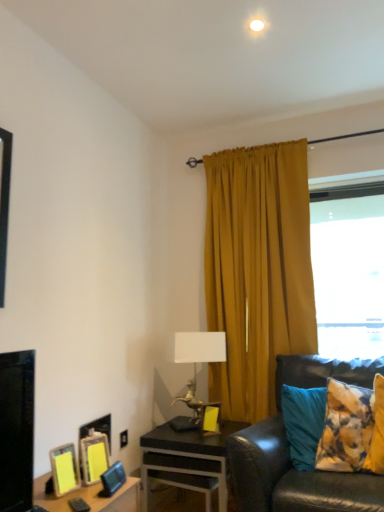
Where is `vacant space that is to the left of yellow matte picture frame at center, which is counted as the 1th picture frame, starting from the right`? This screenshot has height=512, width=384. vacant space that is to the left of yellow matte picture frame at center, which is counted as the 1th picture frame, starting from the right is located at coordinates (186, 435).